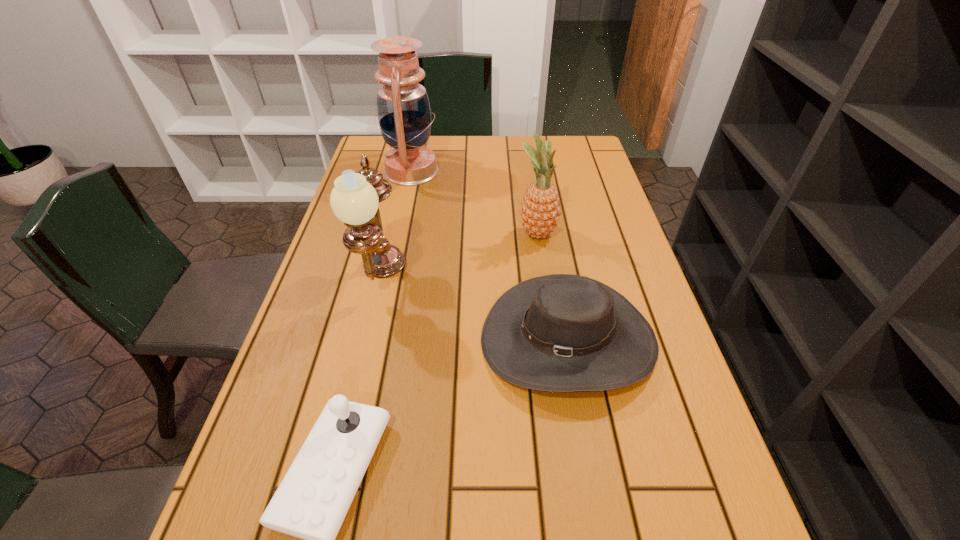
Where is `object located in the far edge section of the desktop`? The height and width of the screenshot is (540, 960). object located in the far edge section of the desktop is located at coordinates (403, 109).

Locate an element on the screen. This screenshot has width=960, height=540. object that is at the right edge is located at coordinates (561, 332).

Find the location of a particular element. This screenshot has width=960, height=540. object present at the far left corner is located at coordinates (403, 109).

The width and height of the screenshot is (960, 540). In the image, there is a desktop. Identify the location of vacant space at the far edge. (467, 166).

At what (x,y) coordinates should I click in order to perform the action: click on vacant region at the left edge of the desktop. Please return your answer as a coordinate pair (x, y). Looking at the image, I should click on (286, 365).

Locate an element on the screen. The width and height of the screenshot is (960, 540). vacant space at the right edge is located at coordinates (636, 281).

Find the location of a particular element. The height and width of the screenshot is (540, 960). vacant region at the far left corner is located at coordinates (371, 153).

You are a GUI agent. You are given a task and a screenshot of the screen. Output one action in this format:
    pyautogui.click(x=<x>, y=<y>)
    Task: Click on the vacant space at the far right corner of the desktop
    
    Given the screenshot: What is the action you would take?
    pyautogui.click(x=579, y=136)

You are a GUI agent. You are given a task and a screenshot of the screen. Output one action in this format:
    pyautogui.click(x=<x>, y=<y>)
    Task: Click on the vacant space in between the nearer oil lamp and the pineapple
    
    Given the screenshot: What is the action you would take?
    pyautogui.click(x=459, y=256)

Find the location of `vacant space that is in between the shorter oil lamp and the second shortest object`. vacant space that is in between the shorter oil lamp and the second shortest object is located at coordinates (474, 310).